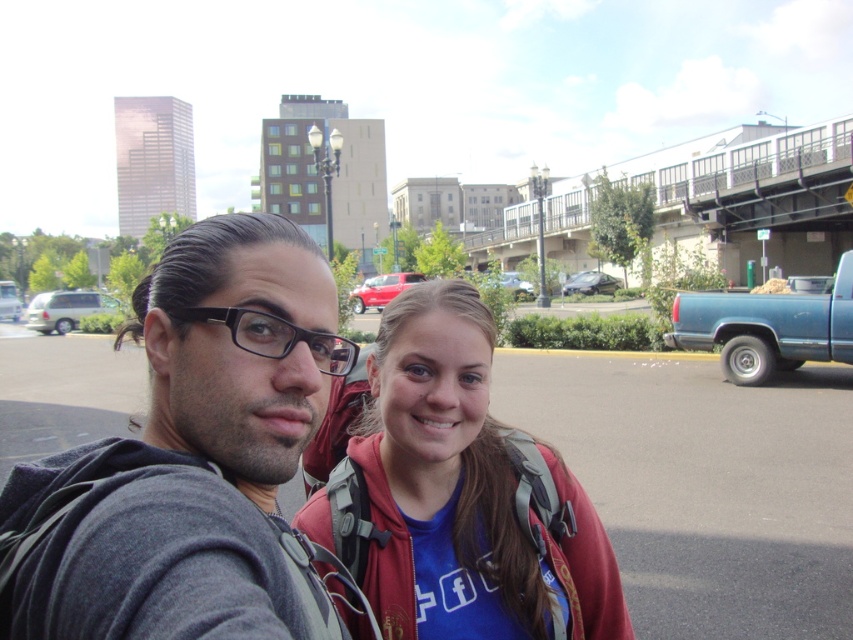
Question: Which object is closer to the camera taking this photo?

Choices:
 (A) metallic silver sedan at center
 (B) matte silver van at center
 (C) matte red backpack at center

Answer: (C)

Question: Is satin black sedan at center positioned at the back of metallic silver sedan at center?

Choices:
 (A) yes
 (B) no

Answer: (A)

Question: Does black plastic glasses at center appear on the right side of metallic silver sedan at center?

Choices:
 (A) yes
 (B) no

Answer: (B)

Question: Observing the image, what is the correct spatial positioning of metallic red car at center in reference to metallic silver sedan at center?

Choices:
 (A) left
 (B) right

Answer: (A)

Question: Which point is closer to the camera taking this photo?

Choices:
 (A) (352, 305)
 (B) (45, 298)

Answer: (B)

Question: Which point is closer to the camera taking this photo?

Choices:
 (A) (378, 298)
 (B) (415, 592)
 (C) (9, 301)
 (D) (599, 420)

Answer: (B)